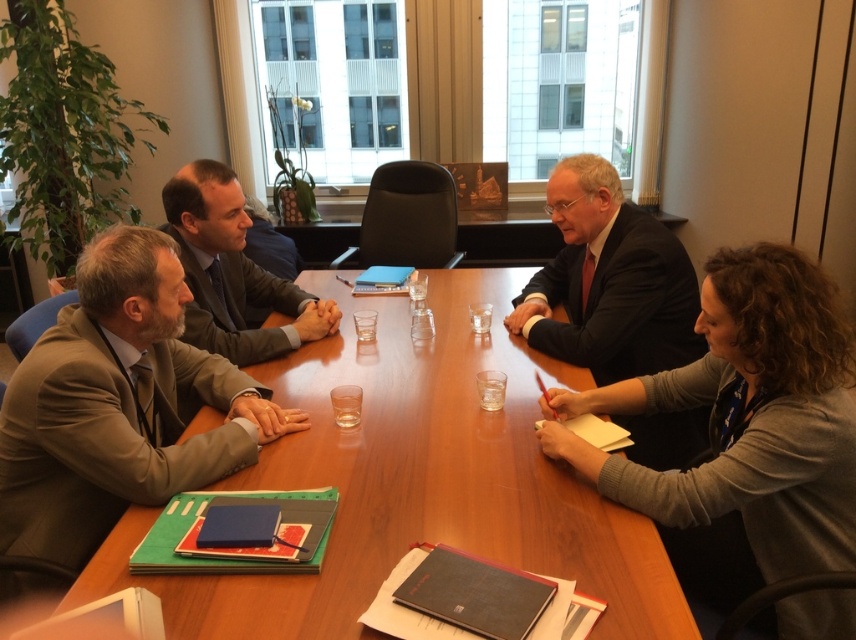
Can you confirm if gray fabric sweater at lower right is positioned below dark suit at center?

Indeed, gray fabric sweater at lower right is positioned under dark suit at center.

This screenshot has height=640, width=856. In order to click on gray fabric sweater at lower right in this screenshot , I will do `click(746, 417)`.

Locate an element on the screen. This screenshot has height=640, width=856. gray fabric sweater at lower right is located at coordinates (746, 417).

Locate an element on the screen. gray fabric sweater at lower right is located at coordinates (746, 417).

Is wooden table at center bigger than dark suit at center?

Indeed, wooden table at center has a larger size compared to dark suit at center.

The image size is (856, 640). In order to click on wooden table at center in this screenshot , I will do `click(415, 481)`.

Does point (669, 269) come in front of point (247, 275)?

Yes, point (669, 269) is in front of point (247, 275).

I want to click on dark suit at center, so click(608, 282).